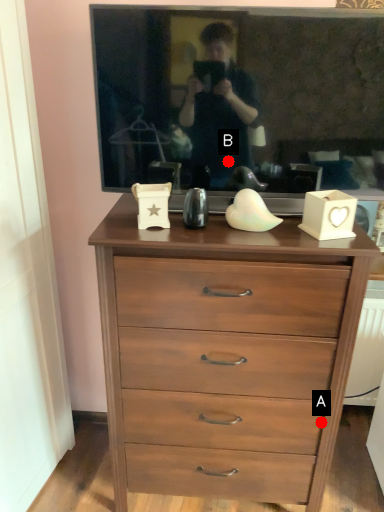
Question: Two points are circled on the image, labeled by A and B beside each circle. Which point is farther to the camera?

Choices:
 (A) A is further
 (B) B is further

Answer: (A)